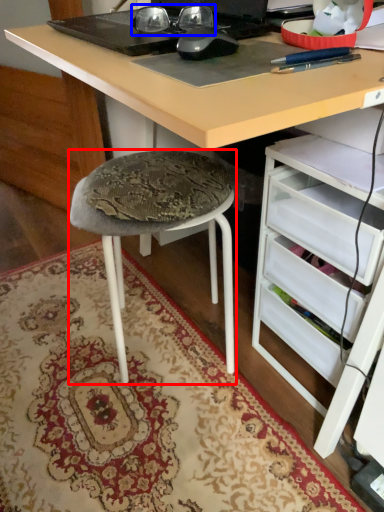
Question: Which point is closer to the camera, stool (highlighted by a red box) or glasses (highlighted by a blue box)?

Choices:
 (A) stool
 (B) glasses

Answer: (B)